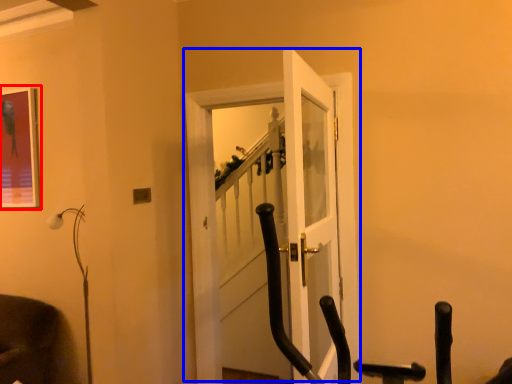
Question: Among these objects, which one is nearest to the camera, picture frame (highlighted by a red box) or door (highlighted by a blue box)?

Choices:
 (A) picture frame
 (B) door

Answer: (B)